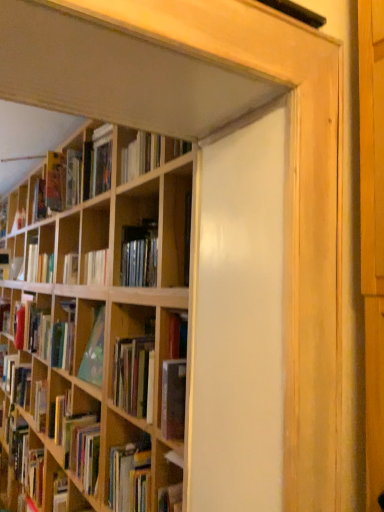
Question: Is matte red book at left, the 1th book from the back, oriented away from hardcover book at upper left, positioned as the 2th book in bottom-to-top order?

Choices:
 (A) no
 (B) yes

Answer: (A)

Question: From a real-world perspective, is matte red book at left, which ranks as the first book in bottom-to-top order, below hardcover book at upper left, which appears as the second book when viewed from the left?

Choices:
 (A) yes
 (B) no

Answer: (A)

Question: Can you confirm if matte red book at left, the second book positioned from the top, is wider than hardcover book at upper left, the 1th book viewed from the top?

Choices:
 (A) yes
 (B) no

Answer: (B)

Question: Can you confirm if matte red book at left, which ranks as the first book in bottom-to-top order, is bigger than hardcover book at upper left, positioned as the 2th book in bottom-to-top order?

Choices:
 (A) yes
 (B) no

Answer: (B)

Question: From a real-world perspective, is matte red book at left, the first book from the left, on top of hardcover book at upper left, which appears as the second book when viewed from the left?

Choices:
 (A) no
 (B) yes

Answer: (A)

Question: From the image's perspective, is matte red book at left, the second book positioned from the top, over hardcover book at upper left, the 1th book viewed from the top?

Choices:
 (A) yes
 (B) no

Answer: (B)

Question: From the image's perspective, is hardcover book at upper left, which is the first book in right-to-left order, beneath matte red book at left, the second book positioned from the top?

Choices:
 (A) yes
 (B) no

Answer: (B)

Question: Is hardcover book at upper left, the 1th book in the front-to-back sequence, not within matte red book at left, which ranks as the first book in bottom-to-top order?

Choices:
 (A) yes
 (B) no

Answer: (A)

Question: Is hardcover book at upper left, positioned as the 2th book in bottom-to-top order, smaller than matte red book at left, which is the 2th book from right to left?

Choices:
 (A) yes
 (B) no

Answer: (B)

Question: Can you confirm if hardcover book at upper left, which is the first book in right-to-left order, is positioned to the left of matte red book at left, the 2th book viewed from the front?

Choices:
 (A) yes
 (B) no

Answer: (B)

Question: Is hardcover book at upper left, positioned as the 2th book in bottom-to-top order, directly adjacent to matte red book at left, the second book positioned from the top?

Choices:
 (A) no
 (B) yes

Answer: (A)

Question: Is hardcover book at upper left, which appears as the second book when viewed from the left, closer to camera compared to matte red book at left, the second book positioned from the top?

Choices:
 (A) no
 (B) yes

Answer: (B)

Question: Is hardcover book at upper left, which is the first book in right-to-left order, taller or shorter than matte red book at left, which is the 2th book from right to left?

Choices:
 (A) tall
 (B) short

Answer: (A)